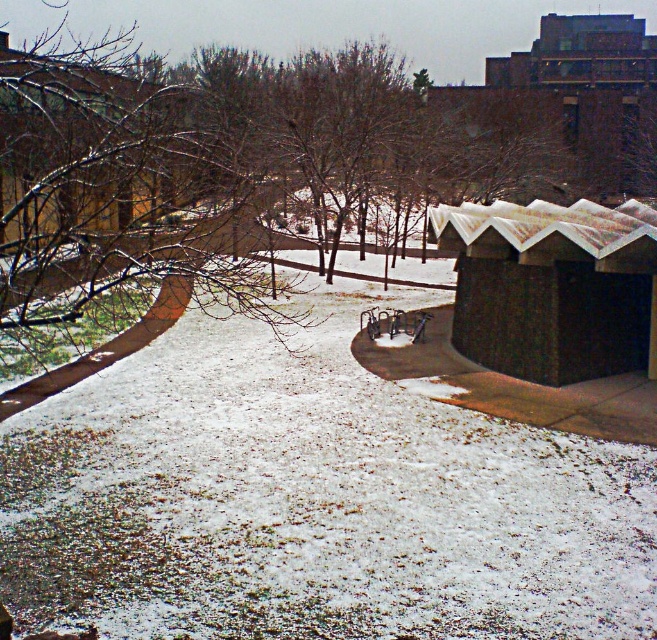
Is brown textured shelter at right thinner than brown wooden hut at upper left?

Indeed, brown textured shelter at right has a lesser width compared to brown wooden hut at upper left.

Can you confirm if brown textured shelter at right is shorter than brown wooden hut at upper left?

Yes, brown textured shelter at right is shorter than brown wooden hut at upper left.

Who is more distant from viewer, (489, 257) or (3, 35)?

A: The point (3, 35) is behind.

The image size is (657, 640). I want to click on brown textured shelter at right, so click(551, 285).

Between point (24, 301) and point (70, 154), which one is positioned in front?

Point (24, 301) is more forward.

Where is `brown bare branches at upper left`? This screenshot has height=640, width=657. brown bare branches at upper left is located at coordinates (118, 202).

Is point (277, 323) farther from viewer compared to point (643, 232)?

Yes, point (277, 323) is farther from viewer.

Is brown bare branches at upper left behind brown textured shelter at right?

That is False.

Measure the distance between point (x=47, y=88) and camera.

They are 11.58 meters apart.

At what (x,y) coordinates should I click in order to perform the action: click on brown bare branches at upper left. Please return your answer as a coordinate pair (x, y). Looking at the image, I should click on (118, 202).